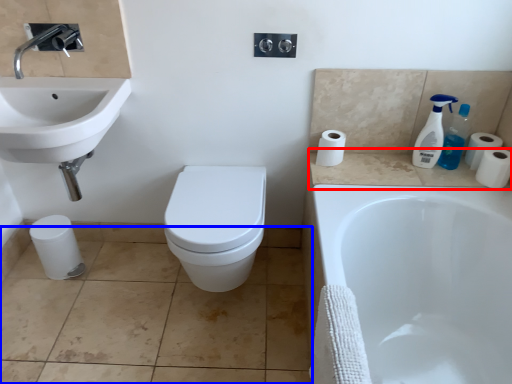
Question: Which of the following is the closest to the observer, counter top (highlighted by a red box) or tile (highlighted by a blue box)?

Choices:
 (A) counter top
 (B) tile

Answer: (B)